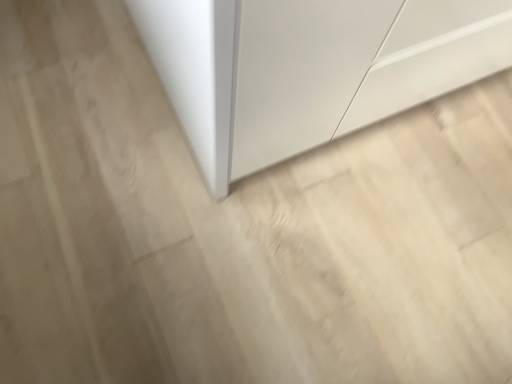
I want to click on white matte cabinet at center, so click(x=309, y=68).

Measure the distance between point (281, 4) and camera.

A distance of 21.97 inches exists between point (281, 4) and camera.

What do you see at coordinates (309, 68) in the screenshot? This screenshot has width=512, height=384. I see `white matte cabinet at center` at bounding box center [309, 68].

Where is `white matte cabinet at center`? The width and height of the screenshot is (512, 384). white matte cabinet at center is located at coordinates (309, 68).